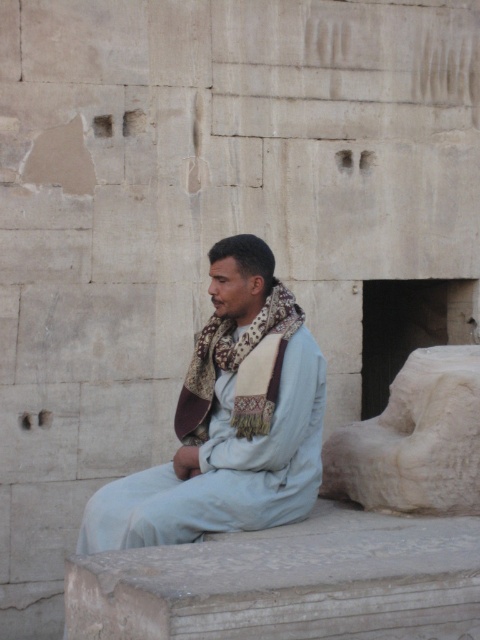
Does smooth gray stone at lower center have a lesser width compared to white stone statue at right?

No, smooth gray stone at lower center is not thinner than white stone statue at right.

Measure the distance between smooth gray stone at lower center and white stone statue at right.

83.11 centimeters

Which is in front, point (307, 564) or point (434, 362)?

Positioned in front is point (307, 564).

Where is `smooth gray stone at lower center`? This screenshot has height=640, width=480. smooth gray stone at lower center is located at coordinates (288, 580).

Based on the photo, can you confirm if smooth gray stone at lower center is positioned below light blue fabric at center?

Indeed, smooth gray stone at lower center is positioned under light blue fabric at center.

Who is more distant from viewer, (231, 550) or (190, 417)?

The point (190, 417) is behind.

The width and height of the screenshot is (480, 640). In order to click on smooth gray stone at lower center in this screenshot , I will do `click(288, 580)`.

Consider the image. Which is below, light blue fabric at center or white stone statue at right?

Positioned lower is white stone statue at right.

Who is positioned more to the right, light blue fabric at center or white stone statue at right?

From the viewer's perspective, white stone statue at right appears more on the right side.

Is point (208, 404) less distant than point (459, 392)?

No, (208, 404) is further to viewer.

The height and width of the screenshot is (640, 480). Identify the location of light blue fabric at center. (229, 420).